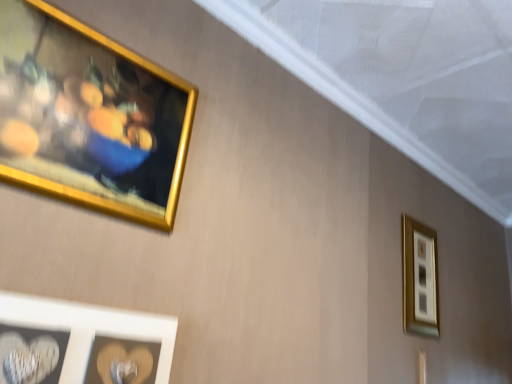
Question: From the image's perspective, is white matte heart at lower left, which is the 2th picture frame from right to left, above gold metallic picture frame at upper right, marked as the first picture frame in a right-to-left arrangement?

Choices:
 (A) no
 (B) yes

Answer: (B)

Question: Could gold metallic picture frame at upper right, the third picture frame when ordered from front to back, be considered to be inside white matte heart at lower left, which is the 2th picture frame from right to left?

Choices:
 (A) no
 (B) yes

Answer: (A)

Question: Can you confirm if white matte heart at lower left, which is the 2th picture frame from right to left, is smaller than gold metallic picture frame at upper right, marked as the first picture frame in a right-to-left arrangement?

Choices:
 (A) yes
 (B) no

Answer: (A)

Question: Is white matte heart at lower left, which appears as the second picture frame when viewed from the left, at the right side of gold metallic picture frame at upper right, the 3th picture frame in the left-to-right sequence?

Choices:
 (A) no
 (B) yes

Answer: (A)

Question: Is white matte heart at lower left, the 3th picture frame from the back, facing away from gold metallic picture frame at upper right, the 3th picture frame in the left-to-right sequence?

Choices:
 (A) yes
 (B) no

Answer: (B)

Question: Relative to gold metallic picture frame at upper right, the first picture frame in the back-to-front sequence, is gold metallic picture frame at upper left, which is the 1th picture frame from left to right, in front or behind?

Choices:
 (A) behind
 (B) front

Answer: (B)

Question: Is point (31, 125) positioned closer to the camera than point (428, 238)?

Choices:
 (A) farther
 (B) closer

Answer: (B)

Question: From a real-world perspective, is gold metallic picture frame at upper left, which is the 1th picture frame from left to right, physically located above or below gold metallic picture frame at upper right, the first picture frame in the back-to-front sequence?

Choices:
 (A) above
 (B) below

Answer: (A)

Question: Looking at their shapes, would you say gold metallic picture frame at upper left, which is the second picture frame in front-to-back order, is wider or thinner than gold metallic picture frame at upper right, the third picture frame when ordered from front to back?

Choices:
 (A) thin
 (B) wide

Answer: (A)

Question: Choose the correct answer: Is white matte heart at lower left, the 3th picture frame from the back, inside gold metallic picture frame at upper left, which is the 1th picture frame from left to right, or outside it?

Choices:
 (A) outside
 (B) inside

Answer: (A)

Question: Considering the positions of point (106, 360) and point (96, 142), is point (106, 360) closer or farther from the camera than point (96, 142)?

Choices:
 (A) closer
 (B) farther

Answer: (A)

Question: Considering the positions of white matte heart at lower left, which is the 2th picture frame from right to left, and gold metallic picture frame at upper left, which is the 1th picture frame from left to right, in the image, is white matte heart at lower left, which is the 2th picture frame from right to left, taller or shorter than gold metallic picture frame at upper left, which is the 1th picture frame from left to right,?

Choices:
 (A) tall
 (B) short

Answer: (B)

Question: Is white matte heart at lower left, which appears as the second picture frame when viewed from the left, to the left or to the right of gold metallic picture frame at upper left, which is the 1th picture frame from left to right, in the image?

Choices:
 (A) right
 (B) left

Answer: (A)

Question: Is gold metallic picture frame at upper left, placed as the second picture frame when sorted from back to front, spatially inside white matte heart at lower left, which is the 2th picture frame from right to left, or outside of it?

Choices:
 (A) outside
 (B) inside

Answer: (A)

Question: From a real-world perspective, is gold metallic picture frame at upper left, which is the second picture frame in front-to-back order, above or below white matte heart at lower left, which appears as the second picture frame when viewed from the left?

Choices:
 (A) below
 (B) above

Answer: (B)